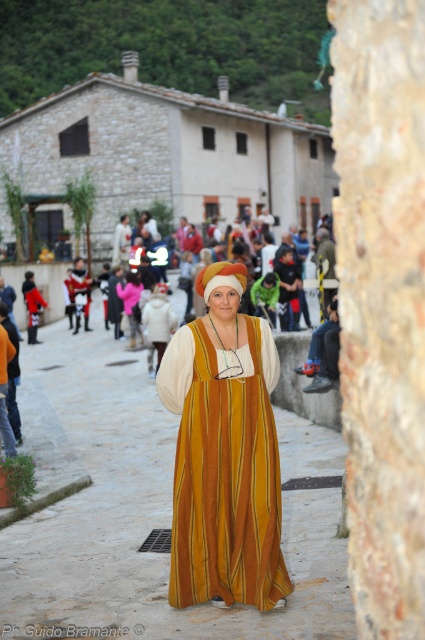
Is striped fabric dress at center taller than velvet yellow dress at center?

In fact, striped fabric dress at center may be shorter than velvet yellow dress at center.

Does striped fabric dress at center have a greater width compared to velvet yellow dress at center?

Indeed, striped fabric dress at center has a greater width compared to velvet yellow dress at center.

Locate an element on the screen. This screenshot has width=425, height=640. striped fabric dress at center is located at coordinates (136, 515).

You are a GUI agent. You are given a task and a screenshot of the screen. Output one action in this format:
    pyautogui.click(x=<x>, y=<y>)
    Task: Click on the striped fabric dress at center
    This screenshot has height=640, width=425.
    Given the screenshot: What is the action you would take?
    pyautogui.click(x=136, y=515)

Does yellow striped dress at center appear on the left side of velvet red cape at center?

In fact, yellow striped dress at center is to the right of velvet red cape at center.

Which is behind, point (325, 296) or point (73, 332)?

Point (73, 332)

The image size is (425, 640). Describe the element at coordinates (325, 269) in the screenshot. I see `yellow striped dress at center` at that location.

This screenshot has width=425, height=640. What are the coordinates of `yellow striped dress at center` in the screenshot? It's located at (325, 269).

Does velvet red cape at center lie in front of pink fabric dress at center?

That is False.

Can you confirm if velvet red cape at center is positioned below pink fabric dress at center?

Incorrect, velvet red cape at center is not positioned below pink fabric dress at center.

Which is in front, point (84, 326) or point (133, 337)?

Point (133, 337)

Where is `velvet red cape at center`? This screenshot has width=425, height=640. velvet red cape at center is located at coordinates (81, 292).